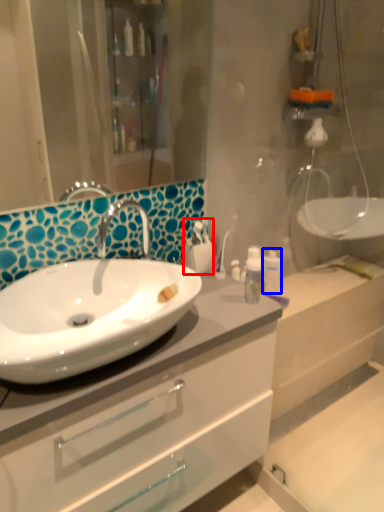
Question: Which point is further to the camera, toiletry (highlighted by a red box) or toiletry (highlighted by a blue box)?

Choices:
 (A) toiletry
 (B) toiletry

Answer: (B)